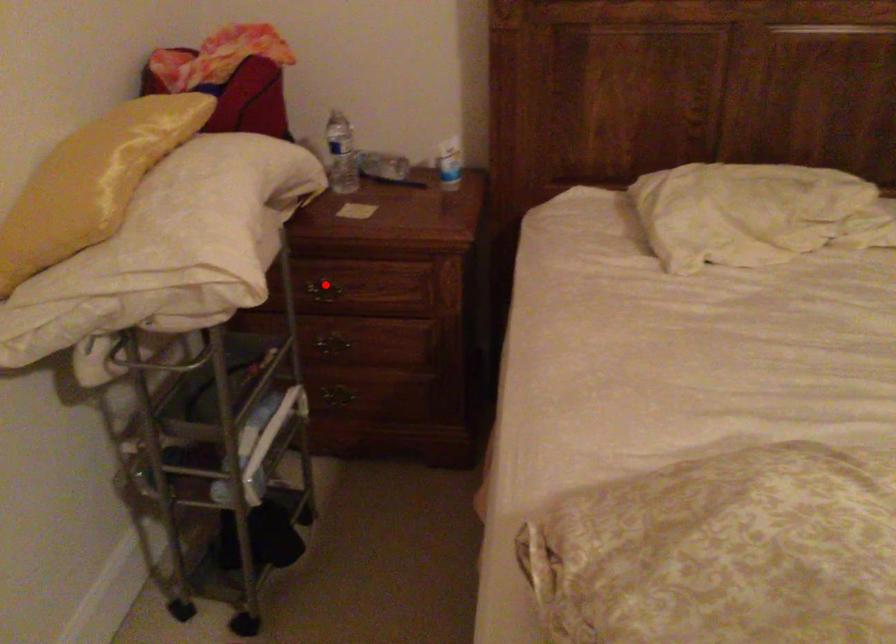
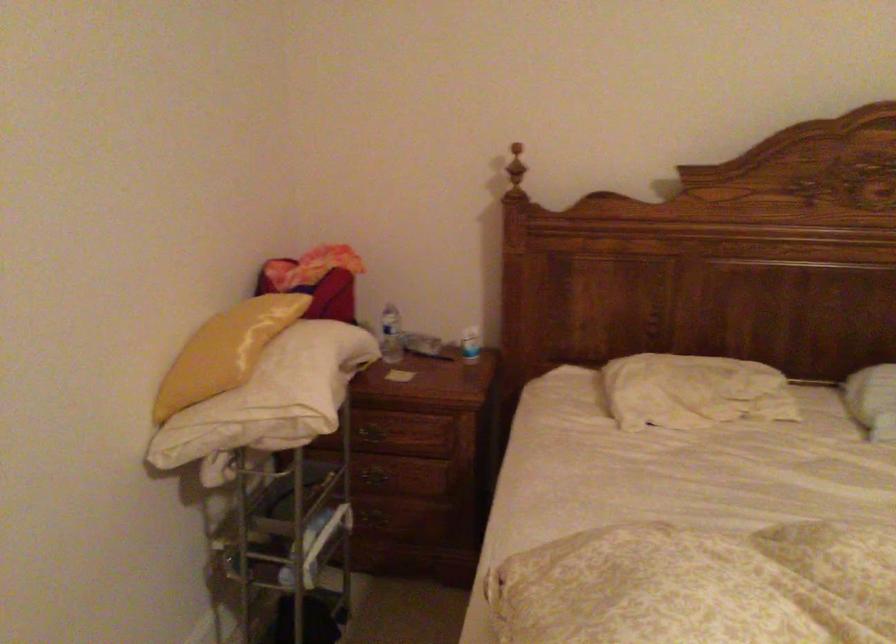
Question: I am providing you with two images of the same scene from different viewpoints. In image1, a red point is highlighted. Considering the same 3D point in image2, which of the following is correct?

Choices:
 (A) It is closer
 (B) It is farther

Answer: (B)